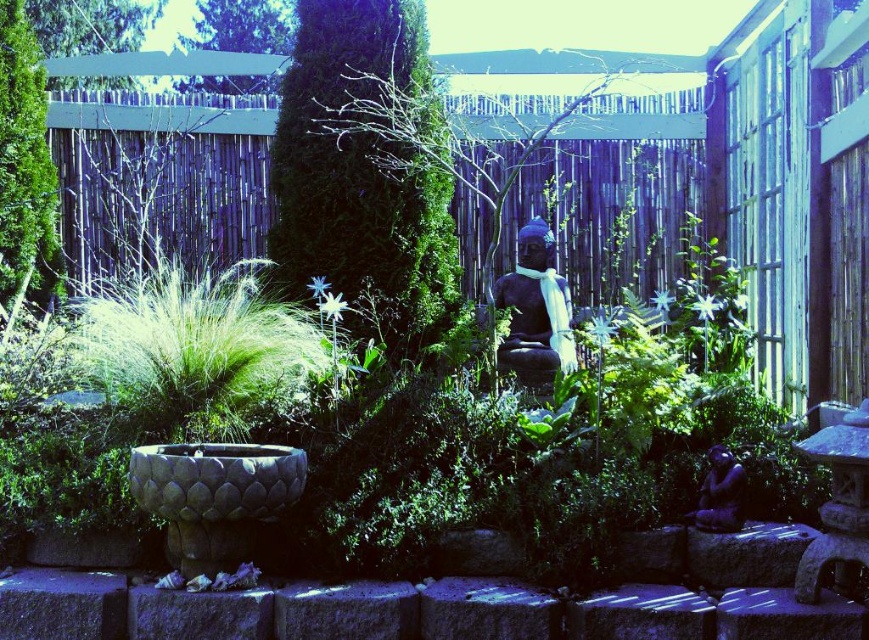
Can you confirm if green textured bush at center is positioned above green textured bush at left?

Incorrect, green textured bush at center is not positioned above green textured bush at left.

The height and width of the screenshot is (640, 869). I want to click on green textured bush at center, so [x=365, y=172].

The image size is (869, 640). I want to click on green textured bush at center, so click(365, 172).

Does green textured bush at center appear on the right side of black stone statue at center?

In fact, green textured bush at center is to the left of black stone statue at center.

This screenshot has width=869, height=640. What do you see at coordinates (365, 172) in the screenshot?
I see `green textured bush at center` at bounding box center [365, 172].

The height and width of the screenshot is (640, 869). Find the location of `green textured bush at center`. green textured bush at center is located at coordinates (365, 172).

How much distance is there between green textured bush at left and black stone statue at center?

They are 9.99 feet apart.

Does green textured bush at left come behind black stone statue at center?

Yes, it is behind black stone statue at center.

Where is `green textured bush at left`? The image size is (869, 640). green textured bush at left is located at coordinates (25, 168).